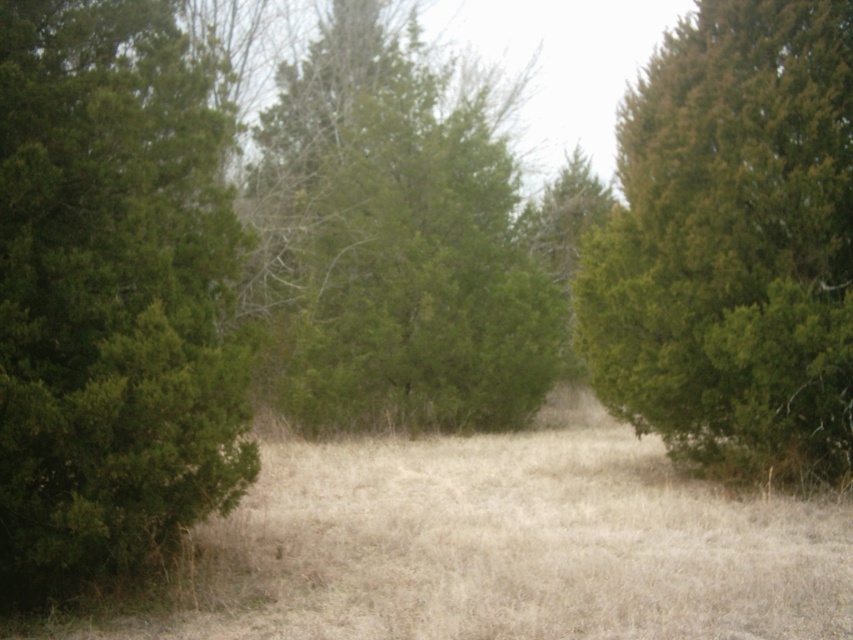
Is green matte tree at left above green matte tree at right?

No, green matte tree at left is not above green matte tree at right.

Find the location of a particular element. The width and height of the screenshot is (853, 640). green matte tree at left is located at coordinates (109, 296).

This screenshot has width=853, height=640. I want to click on green matte tree at left, so click(109, 296).

Is green matte tree at left shorter than green matte tree at center?

Yes, green matte tree at left is shorter than green matte tree at center.

Identify the location of green matte tree at left. The width and height of the screenshot is (853, 640). (109, 296).

Does dry grass at center appear under green matte tree at center?

Yes.

Can you confirm if dry grass at center is positioned above green matte tree at center?

Incorrect, dry grass at center is not positioned above green matte tree at center.

Where is `dry grass at center`? The height and width of the screenshot is (640, 853). dry grass at center is located at coordinates (495, 547).

Locate an element on the screen. This screenshot has height=640, width=853. dry grass at center is located at coordinates click(x=495, y=547).